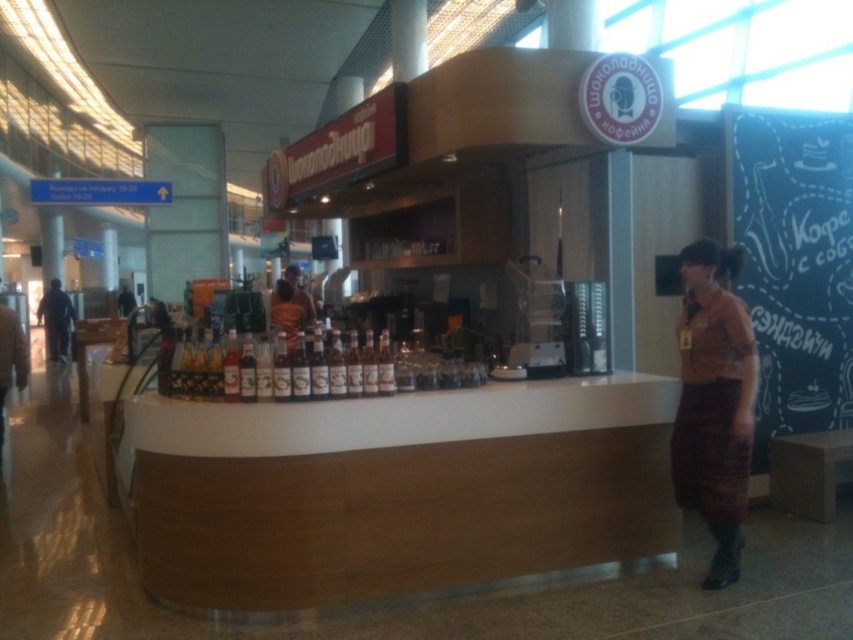
In the scene shown: You are a customer looking at the counter and notice two people. One is wearing a brown woven skirt at right and the other is wearing dark blue jeans at left. Which person is standing closer to the counter?

The brown woven skirt at right is taller than dark blue jeans at left, so the person in the brown woven skirt at right is standing closer to the counter.

You are a customer at the counter and want to ask the person in the brown woven skirt at right for assistance. To approach them, you need to move from the translucent glass bottles at center. In which direction should you move relative to the bottles?

To reach the brown woven skirt at right from the translucent glass bottles at center, you should move to the right, as the brown woven skirt at right is located to the right of the bottles.

You are a customer at the counter and want to grab a bottle from the translucent glass bottles at center. However, there is a staff member in the brown woven skirt at right nearby. Can you easily reach the bottles without moving the staff member?

The brown woven skirt at right occupies less space than translucent glass bottles at center, so the staff member is not blocking the access to the bottles. You can easily reach the bottles without moving them.